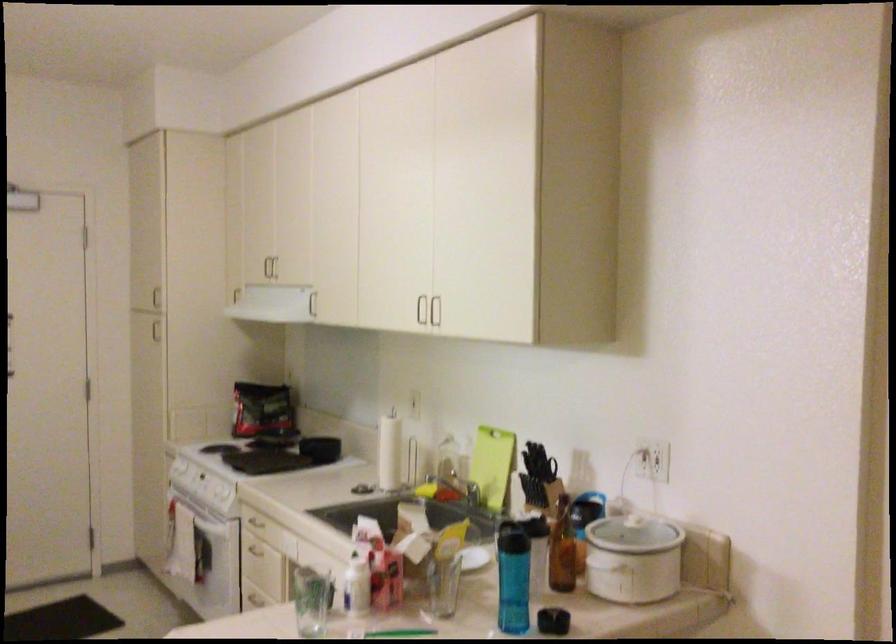
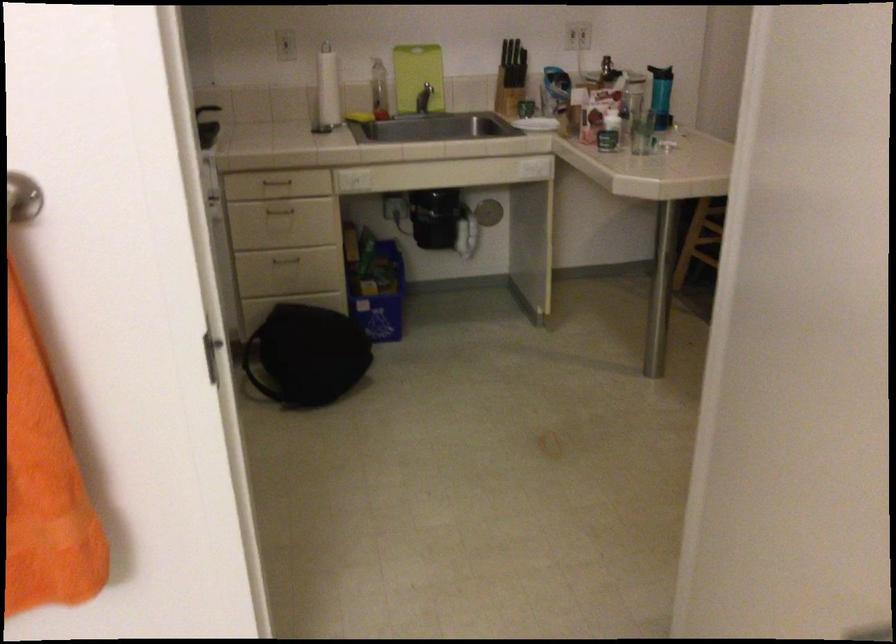
Where in the second image is the point corresponding to point (400, 453) from the first image?

(328, 89)